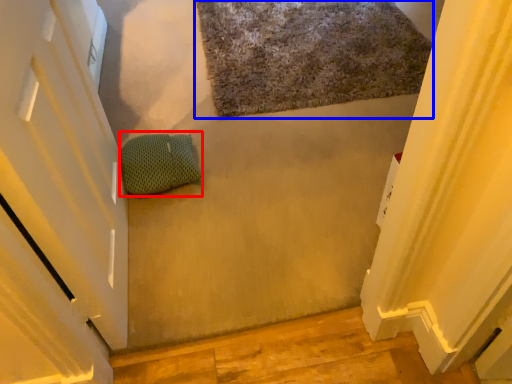
Question: Which point is further to the camera, pillow (highlighted by a red box) or bath mat (highlighted by a blue box)?

Choices:
 (A) pillow
 (B) bath mat

Answer: (B)